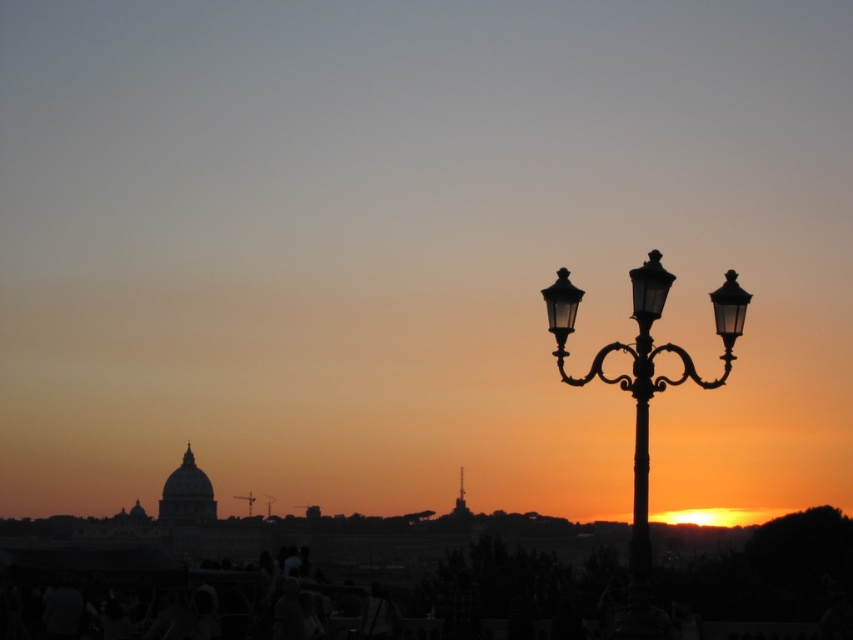
Is black metal lamp post at right closer to the viewer compared to black metal pole at right?

Yes, it is.

Who is higher up, black metal lamp post at right or black metal pole at right?

black metal lamp post at right

Between point (651, 362) and point (636, 316), which one is positioned behind?

The point (636, 316) is behind.

The width and height of the screenshot is (853, 640). I want to click on black metal lamp post at right, so click(x=643, y=365).